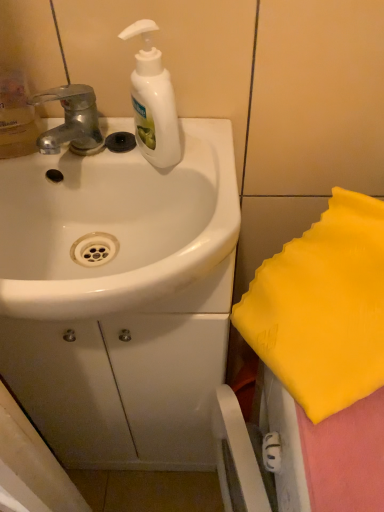
Question: Can you confirm if silver metallic faucet at upper left is wider than white glossy sink at center?

Choices:
 (A) no
 (B) yes

Answer: (A)

Question: Does silver metallic faucet at upper left contain white glossy sink at center?

Choices:
 (A) yes
 (B) no

Answer: (B)

Question: Is silver metallic faucet at upper left behind white glossy sink at center?

Choices:
 (A) yes
 (B) no

Answer: (A)

Question: From a real-world perspective, is silver metallic faucet at upper left over white glossy sink at center?

Choices:
 (A) yes
 (B) no

Answer: (A)

Question: Is silver metallic faucet at upper left facing towards white glossy sink at center?

Choices:
 (A) no
 (B) yes

Answer: (A)

Question: From the image's perspective, relative to white glossy sink at center, is silver metallic faucet at upper left above or below?

Choices:
 (A) above
 (B) below

Answer: (A)

Question: In terms of size, does silver metallic faucet at upper left appear bigger or smaller than white glossy sink at center?

Choices:
 (A) big
 (B) small

Answer: (B)

Question: Considering the positions of silver metallic faucet at upper left and white glossy sink at center in the image, is silver metallic faucet at upper left taller or shorter than white glossy sink at center?

Choices:
 (A) short
 (B) tall

Answer: (A)

Question: From a real-world perspective, is silver metallic faucet at upper left above or below white glossy sink at center?

Choices:
 (A) below
 (B) above

Answer: (B)

Question: In the image, is white glossy sink at center positioned in front of or behind white glossy soap dispenser at upper center?

Choices:
 (A) behind
 (B) front

Answer: (B)

Question: Is white glossy sink at center taller or shorter than white glossy soap dispenser at upper center?

Choices:
 (A) short
 (B) tall

Answer: (A)

Question: From the image's perspective, relative to white glossy soap dispenser at upper center, is white glossy sink at center above or below?

Choices:
 (A) below
 (B) above

Answer: (A)

Question: In the image, is white glossy sink at center on the left side or the right side of white glossy soap dispenser at upper center?

Choices:
 (A) right
 (B) left

Answer: (B)

Question: Visually, is white glossy soap dispenser at upper center positioned to the left or to the right of silver metallic faucet at upper left?

Choices:
 (A) right
 (B) left

Answer: (A)

Question: Is white glossy soap dispenser at upper center in front of or behind silver metallic faucet at upper left in the image?

Choices:
 (A) front
 (B) behind

Answer: (A)